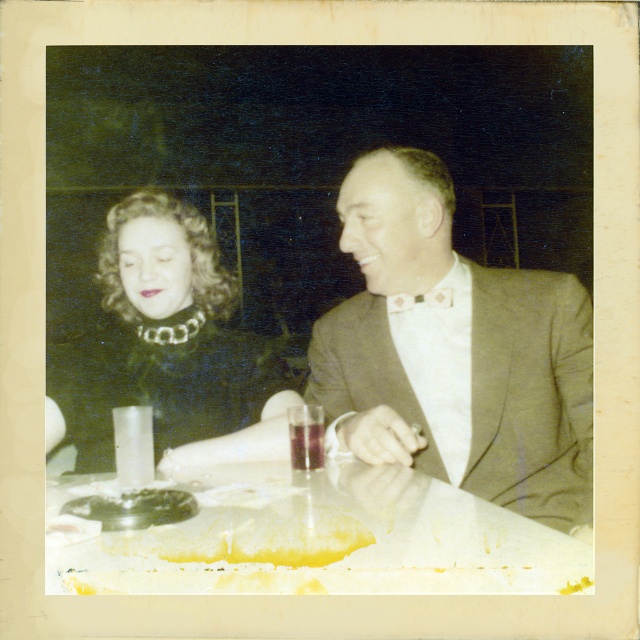
Can you confirm if green velvet dress at left is positioned below yellow wax at lower center?

No, green velvet dress at left is not below yellow wax at lower center.

Identify the location of green velvet dress at left. The image size is (640, 640). (161, 337).

Identify the location of green velvet dress at left. Image resolution: width=640 pixels, height=640 pixels. (161, 337).

Is point (385, 346) closer to viewer compared to point (381, 548)?

That is False.

Who is more distant from viewer, (468, 321) or (371, 556)?

The point (468, 321) is behind.

Where is `light brown textured suit at center`? This screenshot has width=640, height=640. light brown textured suit at center is located at coordinates (454, 352).

Can you confirm if light brown textured suit at center is positioned below green velvet dress at left?

Correct, light brown textured suit at center is located below green velvet dress at left.

Is light brown textured suit at center shorter than green velvet dress at left?

Incorrect, light brown textured suit at center's height does not fall short of green velvet dress at left's.

This screenshot has width=640, height=640. Find the location of `light brown textured suit at center`. light brown textured suit at center is located at coordinates (454, 352).

Image resolution: width=640 pixels, height=640 pixels. Identify the location of light brown textured suit at center. (454, 352).